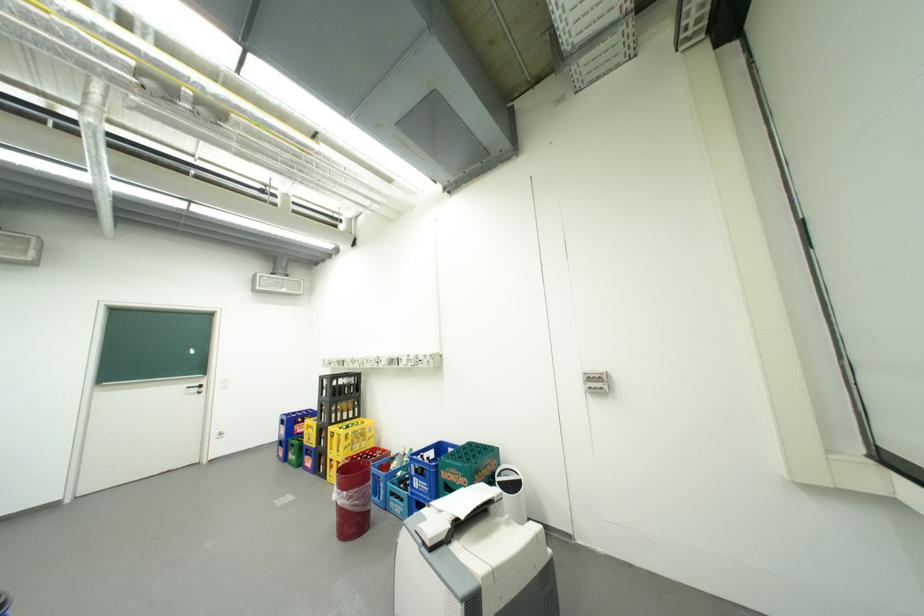
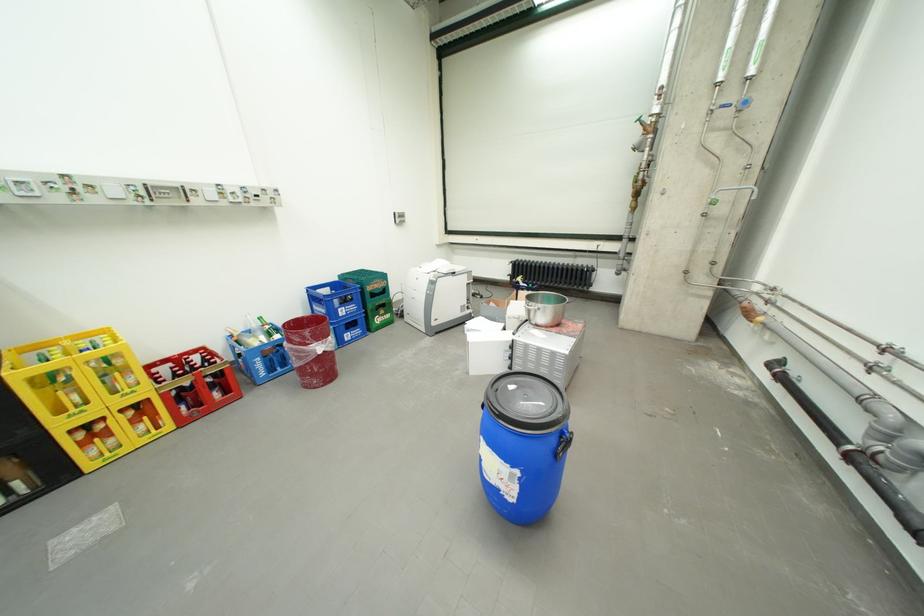
In the second image, find the point that corresponds to (341,430) in the first image.

(30, 374)